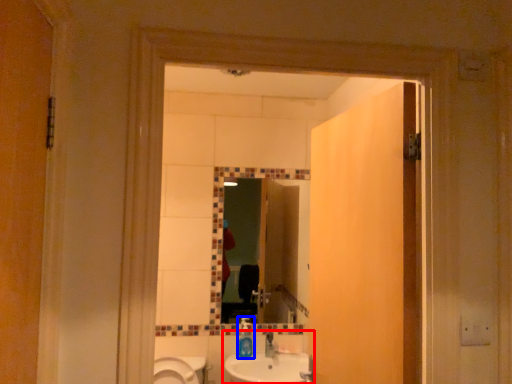
Question: Which point is closer to the camera, sink (highlighted by a red box) or bottle (highlighted by a blue box)?

Choices:
 (A) sink
 (B) bottle

Answer: (A)